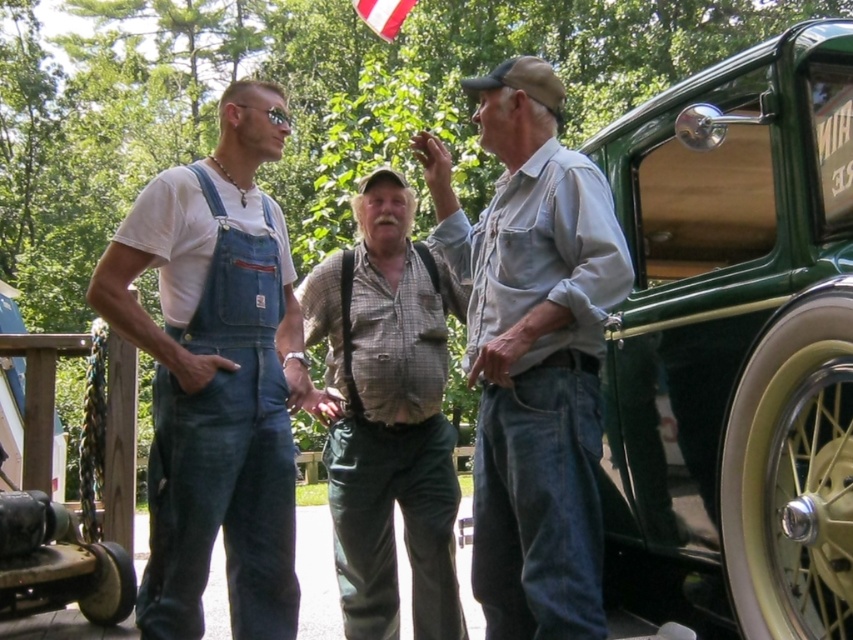
What is the purpose of the point marked at coordinates (734,346) in the scene?

The point marked at coordinates (734,346) indicates the location of the green polished wood door at right.

You are standing in front of the green polished wood door at right and the denim overalls at left. Which object is higher in the image?

The green polished wood door at right is positioned over the denim overalls at left, meaning it is higher in the image.